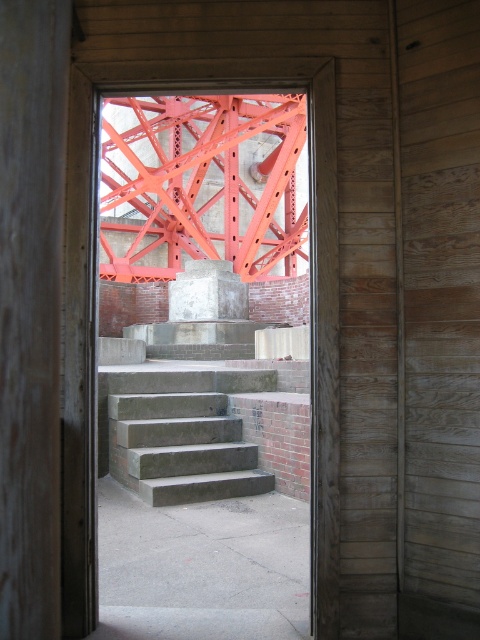
Question: Which object is positioned closest to the bright orange steel structure at center?

Choices:
 (A) concrete stairs at center
 (B) concrete at center

Answer: (B)

Question: Is bright orange steel structure at center above concrete at center?

Choices:
 (A) no
 (B) yes

Answer: (B)

Question: Which of the following is the farthest from the observer?

Choices:
 (A) (112, 192)
 (B) (332, 168)

Answer: (A)

Question: Does concrete stairs at center have a larger size compared to concrete at center?

Choices:
 (A) yes
 (B) no

Answer: (B)

Question: Among these objects, which one is farthest from the camera?

Choices:
 (A) bright orange steel structure at center
 (B) concrete at center

Answer: (B)

Question: Can you confirm if bright orange steel structure at center is positioned to the right of concrete at center?

Choices:
 (A) yes
 (B) no

Answer: (A)